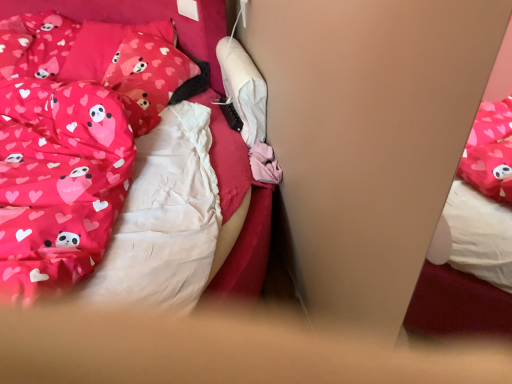
Question: From the image's perspective, is pink fabric pillow at upper left, acting as the 1th pillow starting from the back, located above or below pink satin bed at center?

Choices:
 (A) above
 (B) below

Answer: (A)

Question: Based on their positions, is pink fabric pillow at upper left, the 2th pillow in the front-to-back sequence, located to the left or right of pink satin bed at center?

Choices:
 (A) right
 (B) left

Answer: (A)

Question: Estimate the real-world distances between objects in this image. Which object is closer to the matte pink fabric pillow at upper left, arranged as the first pillow when viewed from the front?

Choices:
 (A) pink satin bed at center
 (B) pink fabric pillow at upper left, acting as the 1th pillow starting from the back

Answer: (B)

Question: Which object is the closest to the pink satin bed at center?

Choices:
 (A) matte pink fabric pillow at upper left, positioned as the 2th pillow in back-to-front order
 (B) pink fabric pillow at upper left, acting as the 1th pillow starting from the back

Answer: (A)